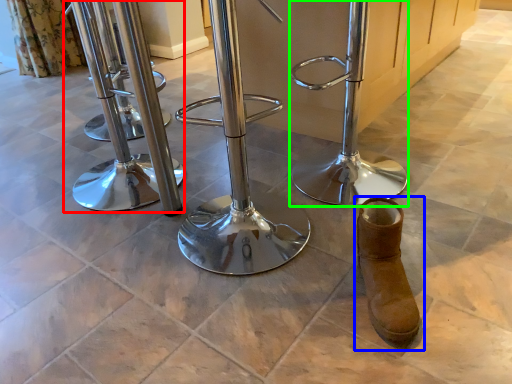
Question: Based on their relative distances, which object is nearer to swivel chair (highlighted by a red box)? Choose from footwear (highlighted by a blue box) and swivel chair (highlighted by a green box).

Choices:
 (A) footwear
 (B) swivel chair

Answer: (B)